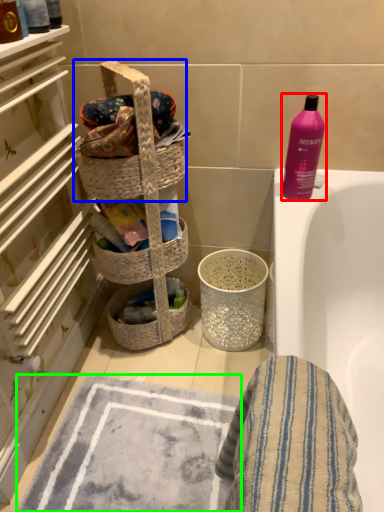
Question: Which is nearer to the bottle (highlighted by a red box)? picnic basket (highlighted by a blue box) or bath mat (highlighted by a green box).

Choices:
 (A) picnic basket
 (B) bath mat

Answer: (A)